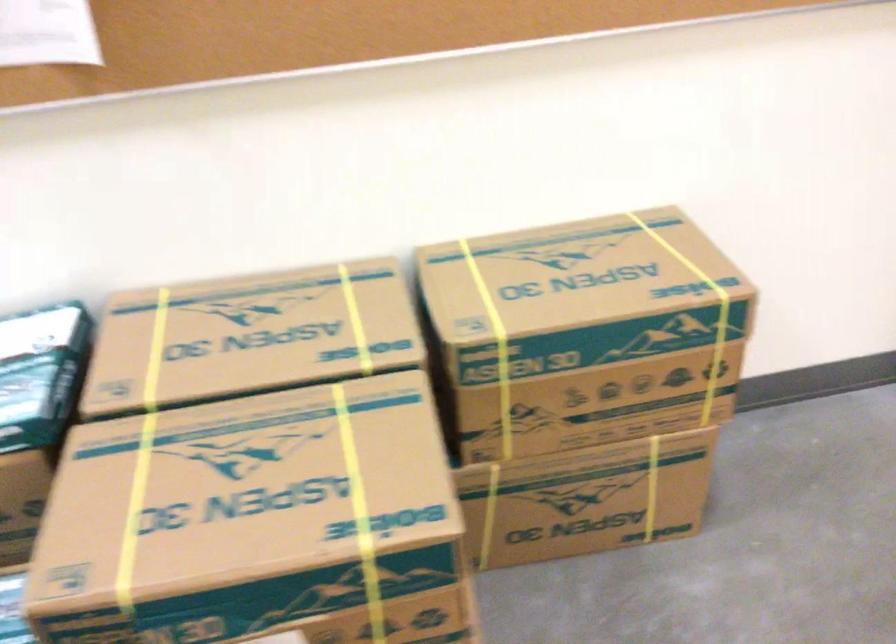
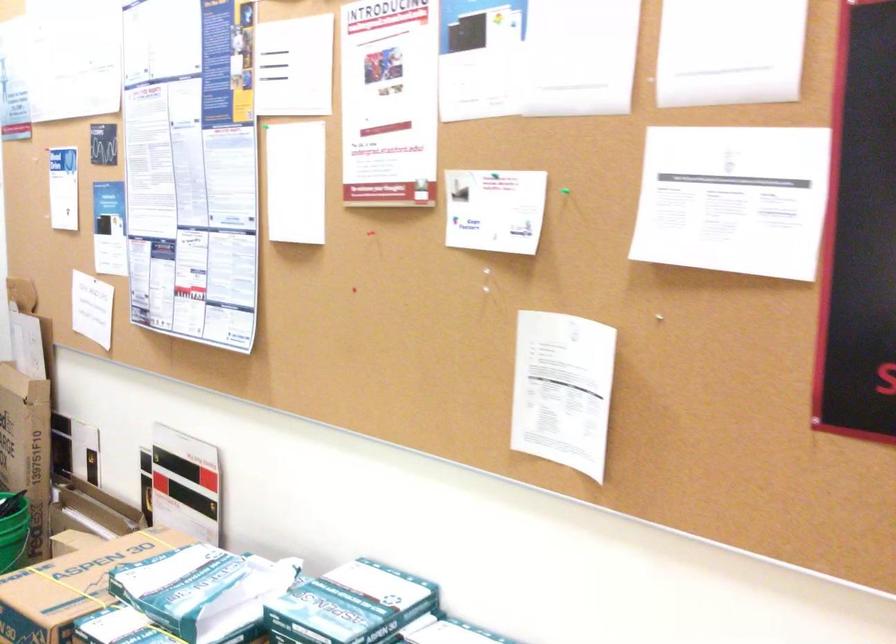
Question: The images are taken continuously from a first-person perspective. In which direction is your viewpoint rotating?

Choices:
 (A) Left
 (B) Right
 (C) Up
 (D) Down

Answer: (A)